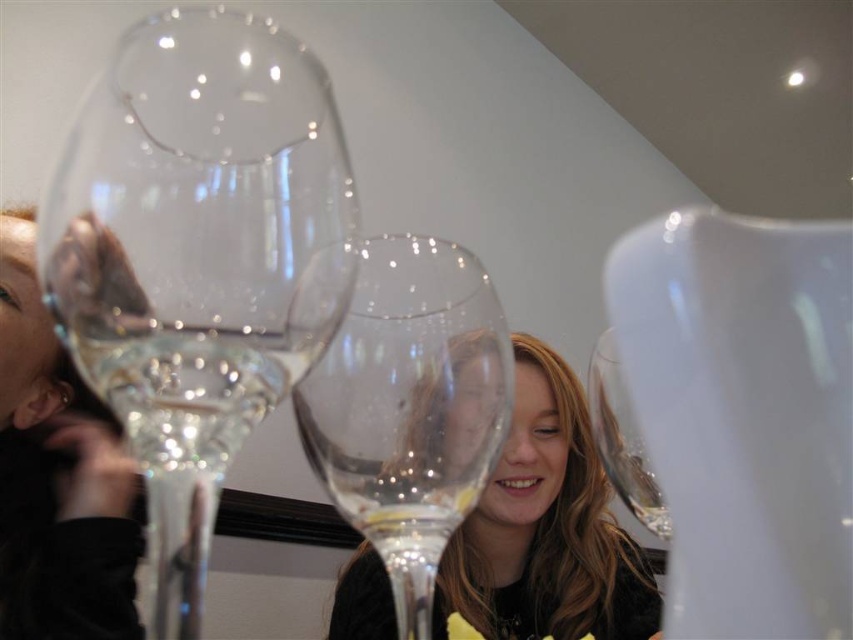
You are arranging wine glasses on a table for a party. You have a new glass that needs to be placed exactly at point 0.5, 0.25. The transparent glass wine glass at left is already at point 0.403, 0.233. Will the new glass be to the right or left of the existing one?

The transparent glass wine glass at left is located at point (x=198, y=257). The new glass is at (x=212, y=320). Comparing the x coordinates, 0.5 is greater than 0.403, so the new glass will be to the right of the existing transparent glass wine glass at left.

You are a bartender who needs to place a coaster between two wine glasses to prevent condensation damage. The coaster you have is 15 centimeters in diameter. Can you fit it between the transparent glass wine glass at center and the clear glass wine glass at center?

The distance between the transparent glass wine glass at center and the clear glass wine glass at center is 16.07 centimeters. Since the coaster is 15 centimeters in diameter, it can fit between them as the space is slightly larger than the coaster.

You are a bartender trying to place a coaster at point (198,257). Which object should you place it under?

The point (198,257) corresponds to the transparent glass wine glass at left, so you should place the coaster under the transparent glass wine glass at left.